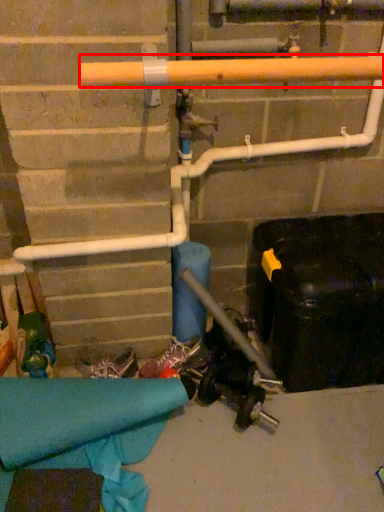
Question: From the image's perspective, where is beam (annotated by the red box) located relative to footwear?

Choices:
 (A) below
 (B) above

Answer: (B)